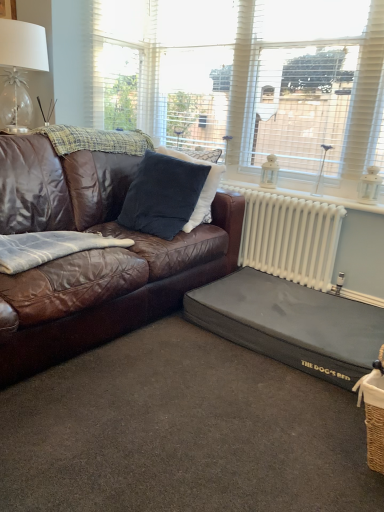
Question: Considering the relative sizes of white textured window at upper center, which is counted as the first window, starting from the left, and black fabric dog bed at lower right in the image provided, is white textured window at upper center, which is counted as the first window, starting from the left, smaller than black fabric dog bed at lower right?

Choices:
 (A) no
 (B) yes

Answer: (A)

Question: Is white textured window at upper center, marked as the 2th window in a right-to-left arrangement, taller than black fabric dog bed at lower right?

Choices:
 (A) yes
 (B) no

Answer: (A)

Question: From the image's perspective, is white textured window at upper center, marked as the 2th window in a right-to-left arrangement, above black fabric dog bed at lower right?

Choices:
 (A) yes
 (B) no

Answer: (A)

Question: Could you tell me if white textured window at upper center, which is counted as the first window, starting from the left, is turned towards black fabric dog bed at lower right?

Choices:
 (A) no
 (B) yes

Answer: (A)

Question: Is white textured window at upper center, marked as the 2th window in a right-to-left arrangement, with black fabric dog bed at lower right?

Choices:
 (A) no
 (B) yes

Answer: (A)

Question: Considering their positions, is black fabric dog bed at lower right located in front of or behind white textured window at upper center, marked as the 2th window in a right-to-left arrangement?

Choices:
 (A) front
 (B) behind

Answer: (A)

Question: Is point (221, 329) positioned closer to the camera than point (352, 105)?

Choices:
 (A) farther
 (B) closer

Answer: (B)

Question: From a real-world perspective, is black fabric dog bed at lower right above or below white textured window at upper center, which is counted as the first window, starting from the left?

Choices:
 (A) above
 (B) below

Answer: (B)

Question: Considering the positions of black fabric dog bed at lower right and white textured window at upper center, which is counted as the first window, starting from the left, in the image, is black fabric dog bed at lower right taller or shorter than white textured window at upper center, which is counted as the first window, starting from the left,?

Choices:
 (A) short
 (B) tall

Answer: (A)

Question: From a real-world perspective, is brown leather couch at left physically located above or below velvety dark blue pillow at center?

Choices:
 (A) above
 (B) below

Answer: (B)

Question: Considering the positions of brown leather couch at left and velvety dark blue pillow at center in the image, is brown leather couch at left wider or thinner than velvety dark blue pillow at center?

Choices:
 (A) wide
 (B) thin

Answer: (A)

Question: In terms of height, does brown leather couch at left look taller or shorter compared to velvety dark blue pillow at center?

Choices:
 (A) tall
 (B) short

Answer: (A)

Question: Is point (43, 188) closer or farther from the camera than point (142, 224)?

Choices:
 (A) closer
 (B) farther

Answer: (A)

Question: From a real-world perspective, is plaid woolen blanket at upper left, the 1th blanket when ordered from back to front, above or below white metallic radiator at right?

Choices:
 (A) above
 (B) below

Answer: (A)

Question: In terms of width, does plaid woolen blanket at upper left, which is counted as the 2th blanket, starting from the front, look wider or thinner when compared to white metallic radiator at right?

Choices:
 (A) wide
 (B) thin

Answer: (A)